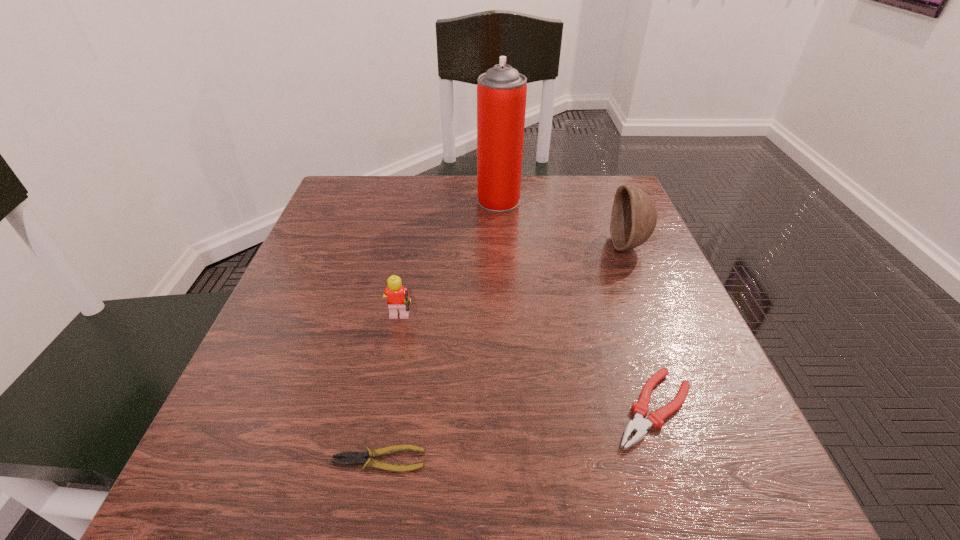
In the image, there is a desktop. Where is `vacant space at the near edge`? vacant space at the near edge is located at coordinates (537, 513).

You are a GUI agent. You are given a task and a screenshot of the screen. Output one action in this format:
    pyautogui.click(x=<x>, y=<y>)
    Task: Click on the free space at the left edge of the desktop
    This screenshot has width=960, height=540.
    Given the screenshot: What is the action you would take?
    pyautogui.click(x=319, y=266)

Find the location of `free space at the far left corner`. free space at the far left corner is located at coordinates (364, 176).

You are a GUI agent. You are given a task and a screenshot of the screen. Output one action in this format:
    pyautogui.click(x=<x>, y=<y>)
    Task: Click on the vacant space at the far right corner
    Image resolution: width=960 pixels, height=540 pixels.
    Given the screenshot: What is the action you would take?
    coord(605,187)

In the image, there is a desktop. At what (x,y) coordinates should I click in order to perform the action: click on free space at the near right corner. Please return your answer as a coordinate pair (x, y). The image size is (960, 540). Looking at the image, I should click on (656, 496).

Locate an element on the screen. The image size is (960, 540). vacant space that's between the fourth nearest object and the third tallest object is located at coordinates (514, 284).

This screenshot has width=960, height=540. I want to click on free space between the second tallest object and the third object from left to right, so click(x=564, y=223).

Where is `empty space between the shorter pliers and the second farthest object`? empty space between the shorter pliers and the second farthest object is located at coordinates (504, 353).

You are a GUI agent. You are given a task and a screenshot of the screen. Output one action in this format:
    pyautogui.click(x=<x>, y=<y>)
    Task: Click on the free space between the Lego and the left pliers
    This screenshot has height=540, width=960.
    Given the screenshot: What is the action you would take?
    pyautogui.click(x=389, y=390)

What are the coordinates of `vacant area that lies between the aerosol can and the third shortest object` in the screenshot? It's located at (449, 261).